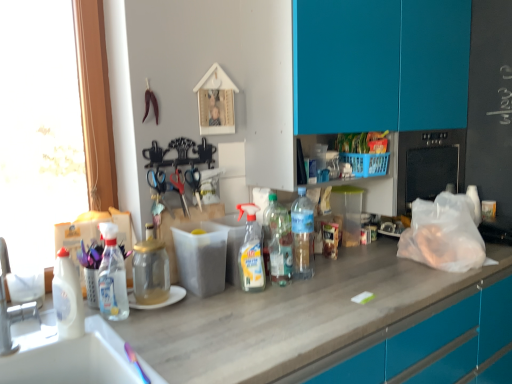
Question: Would you say white glossy bottle at left, which is the sixth bottle from right to left, is inside or outside brushed metal faucet at lower left?

Choices:
 (A) outside
 (B) inside

Answer: (A)

Question: Considering their positions, is white glossy bottle at left, which is the sixth bottle from right to left, located in front of or behind brushed metal faucet at lower left?

Choices:
 (A) front
 (B) behind

Answer: (B)

Question: Estimate the real-world distances between objects in this image. Which object is closer to the metallic sheen scissors at center, which appears as the third scissors when viewed from the right?

Choices:
 (A) clear plastic bottle at center, placed as the 1th bottle when sorted from right to left
 (B) white glossy bottle at left, the first bottle from the left
 (C) translucent plastic bottles at center, the 2th bottle viewed from the right
 (D) transparent glass jar at center, acting as the 3th bottle starting from the left
 (E) transparent plastic spray bottle at left, arranged as the 5th bottle when viewed from the right

Answer: (D)

Question: Which object is positioned closest to the clear plastic bottle at center, which is the sixth bottle in left-to-right order?

Choices:
 (A) metallic sheen scissors at center, acting as the 1th scissors starting from the left
 (B) translucent plastic bottles at center, the 2th bottle viewed from the right
 (C) white glossy bottle at left, the first bottle from the left
 (D) transparent plastic spray bottle at left, positioned as the second bottle in left-to-right order
 (E) transparent glass jar at center, the 4th bottle viewed from the right

Answer: (B)